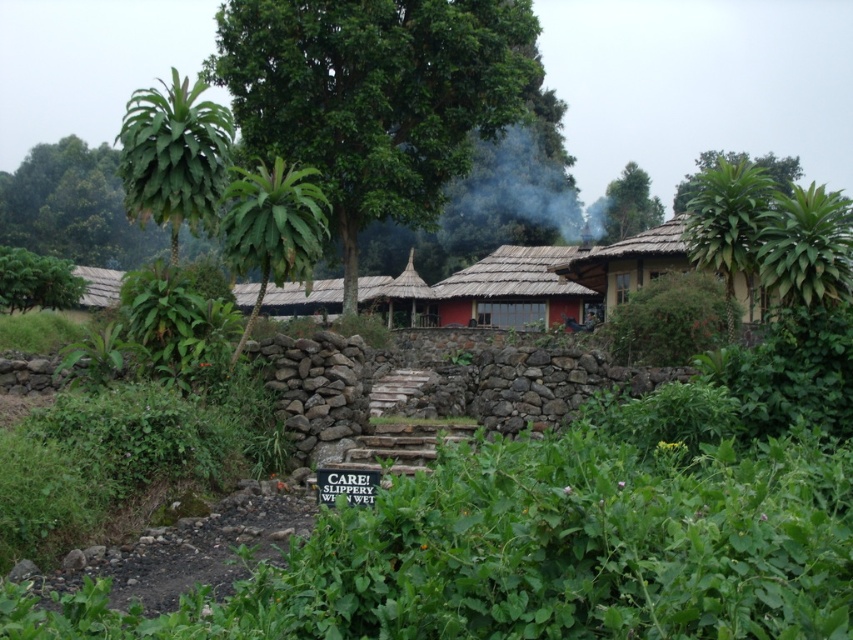
Question: Estimate the real-world distances between objects in this image. Which object is closer to the red clay hut at center?

Choices:
 (A) brown thatched hut at right
 (B) thatched roof hut at center
 (C) gray smoke at upper center
 (D) thatched straw hut at center

Answer: (A)

Question: Is green leafy tree at upper right to the left of thatched roof hut at left from the viewer's perspective?

Choices:
 (A) no
 (B) yes

Answer: (A)

Question: Is green leafy tree at upper center bigger than green leafy tree at upper right?

Choices:
 (A) yes
 (B) no

Answer: (B)

Question: Is green leafy tree at center to the left of thatched roof hut at center from the viewer's perspective?

Choices:
 (A) yes
 (B) no

Answer: (B)

Question: Which point is farther to the camera?

Choices:
 (A) green leafy tree at upper center
 (B) thatched roof hut at center

Answer: (A)

Question: Which point is farther to the camera?

Choices:
 (A) (392, 301)
 (B) (486, 157)
 (C) (633, 204)
 (D) (113, 304)

Answer: (C)